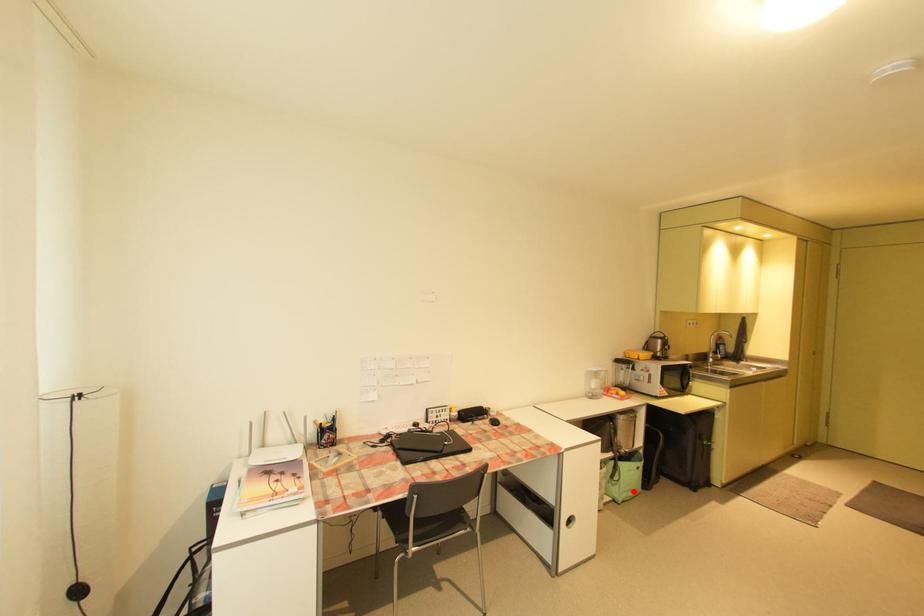
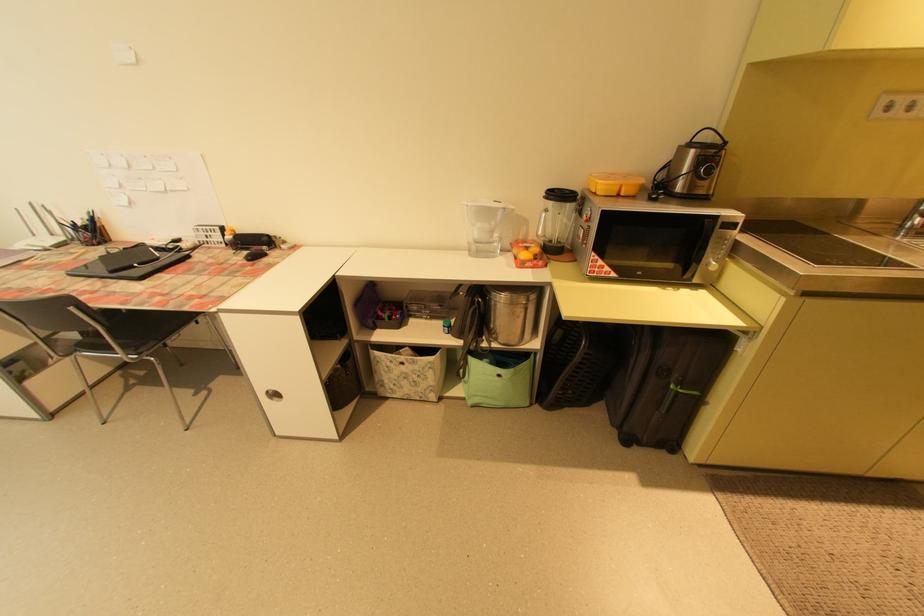
Where in the second image is the point corresponding to the highlighted location from the first image?

(492, 398)